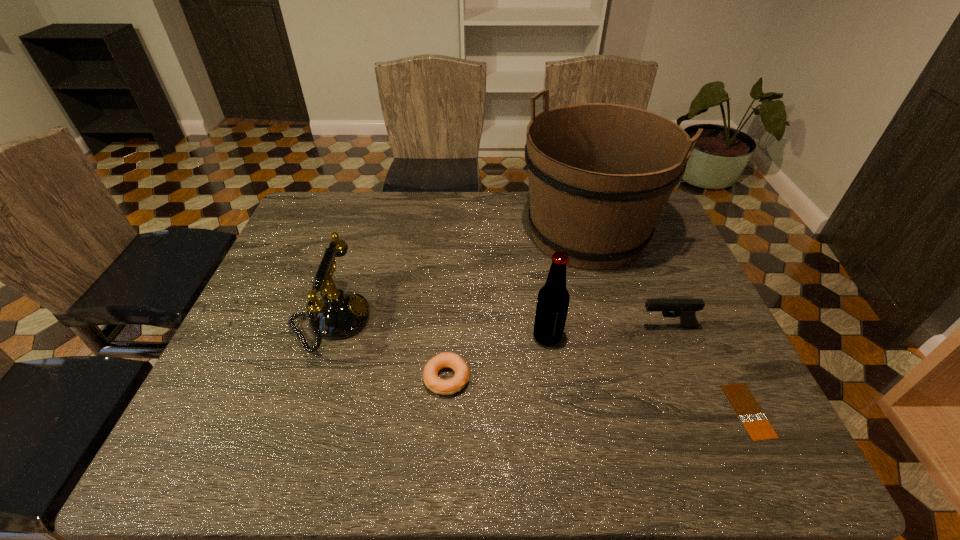
Identify which object is the second closest to the bagel. Please provide its 2D coordinates. Your answer should be formatted as a tuple, i.e. [(x, y)], where the tuple contains the x and y coordinates of a point satisfying the conditions above.

[(553, 299)]

Identify which object is located as the third nearest to the fifth object from right to left. Please provide its 2D coordinates. Your answer should be formatted as a tuple, i.e. [(x, y)], where the tuple contains the x and y coordinates of a point satisfying the conditions above.

[(600, 174)]

Locate an element on the screen. The image size is (960, 540). vacant space that satisfies the following two spatial constraints: 1. on the front-facing side of the chocolate bar; 2. on the left side of the pistol is located at coordinates (701, 411).

Where is `free location that satisfies the following two spatial constraints: 1. on the front-facing side of the pistol; 2. on the front side of the second tallest object`? The height and width of the screenshot is (540, 960). free location that satisfies the following two spatial constraints: 1. on the front-facing side of the pistol; 2. on the front side of the second tallest object is located at coordinates [x=671, y=337].